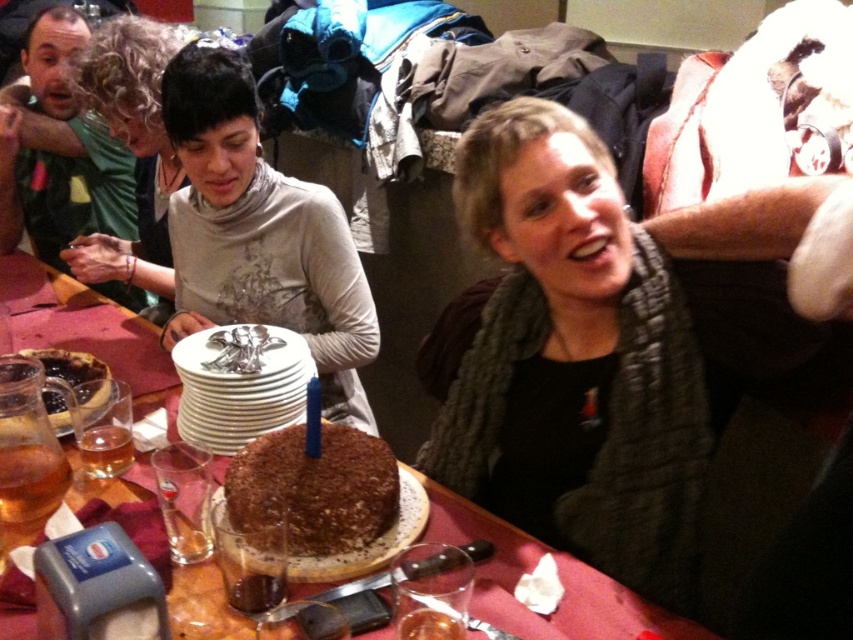
Question: Is knitted gray scarf at upper right positioned before brown textured cake at center?

Choices:
 (A) no
 (B) yes

Answer: (B)

Question: Does matte silver cake at center appear under chocolate crumbly cake at center?

Choices:
 (A) no
 (B) yes

Answer: (A)

Question: Which point is farther to the camera?

Choices:
 (A) (335, 499)
 (B) (508, 214)
 (C) (225, 88)

Answer: (C)

Question: Based on their relative distances, which object is nearer to the chocolate crumbly cake at center?

Choices:
 (A) matte silver cake at center
 (B) knitted gray scarf at upper right
 (C) brown textured cake at center

Answer: (C)

Question: Can you confirm if knitted gray scarf at upper right is positioned above matte silver cake at center?

Choices:
 (A) no
 (B) yes

Answer: (A)

Question: Which point is closer to the camera?

Choices:
 (A) chocolate crumbly cake at center
 (B) brown textured cake at center
 (C) matte silver cake at center
 (D) knitted gray scarf at upper right

Answer: (A)